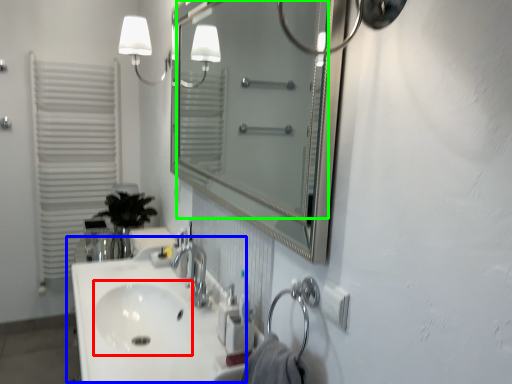
Question: Based on their relative distances, which object is farther from sink (highlighted by a red box)? Choose from sink (highlighted by a blue box) and mirror (highlighted by a green box).

Choices:
 (A) sink
 (B) mirror

Answer: (B)